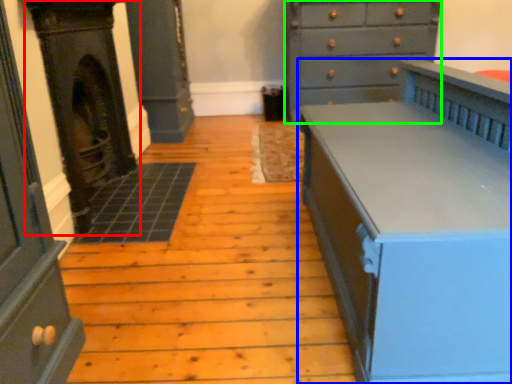
Question: Which object is positioned closest to fireplace (highlighted by a red box)? Select from chest of drawers (highlighted by a blue box) and chest of drawers (highlighted by a green box).

Choices:
 (A) chest of drawers
 (B) chest of drawers

Answer: (A)